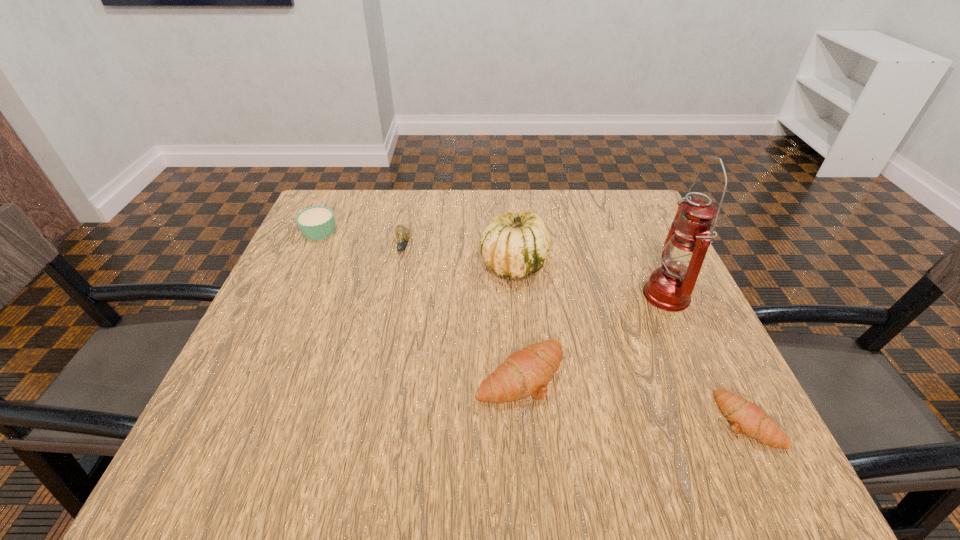
Where is `empty location between the oil lamp and the shortest object`? empty location between the oil lamp and the shortest object is located at coordinates (707, 357).

Identify the location of free space between the cupcake and the escargot. (361, 239).

Locate an element on the screen. empty location between the oil lamp and the left crescent roll is located at coordinates (593, 334).

The height and width of the screenshot is (540, 960). I want to click on free space that is in between the shorter crescent roll and the taller crescent roll, so click(x=634, y=397).

This screenshot has height=540, width=960. What are the coordinates of `vacant area that lies between the left crescent roll and the oil lamp` in the screenshot? It's located at (593, 334).

Identify the location of free spot between the taller crescent roll and the shorter crescent roll. (634, 397).

In order to click on the third closest object relative to the second tallest object in this screenshot , I will do `click(669, 288)`.

Locate which object ranks second in proximity to the shortest object. Please provide its 2D coordinates. Your answer should be formatted as a tuple, i.e. [(x, y)], where the tuple contains the x and y coordinates of a point satisfying the conditions above.

[(526, 372)]

Find the location of a particular element. The image size is (960, 540). free spot that satisfies the following two spatial constraints: 1. on the front-facing side of the fifth shortest object; 2. on the right side of the escargot is located at coordinates (399, 264).

At what (x,y) coordinates should I click in order to perform the action: click on vacant area in the image that satisfies the following two spatial constraints: 1. on the front side of the shortest object; 2. on the left side of the cupcake. Please return your answer as a coordinate pair (x, y). This screenshot has width=960, height=540. Looking at the image, I should click on (232, 420).